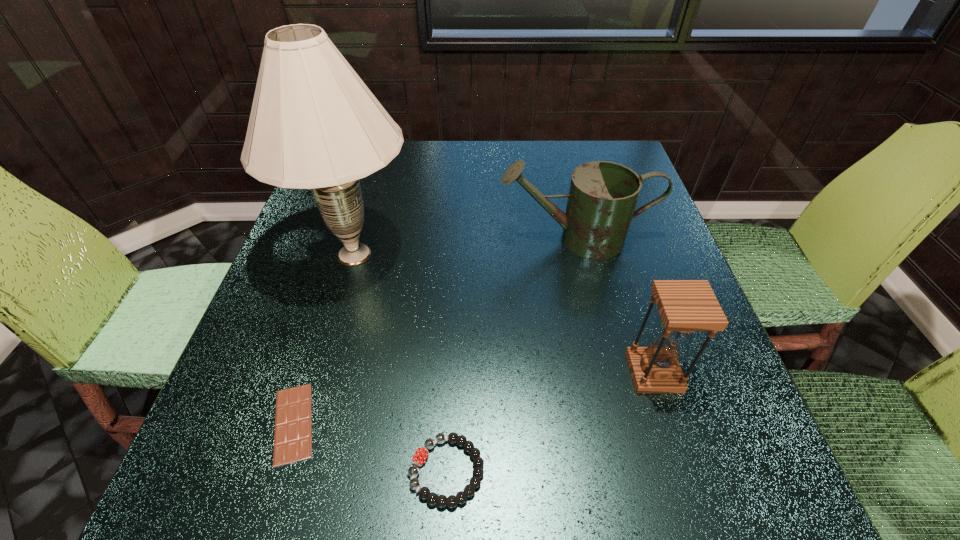
This screenshot has width=960, height=540. I want to click on lampshade, so [x=314, y=124].

At what (x,y) coordinates should I click in order to perform the action: click on watering can. Please return your answer as a coordinate pair (x, y). This screenshot has height=540, width=960. Looking at the image, I should click on (602, 198).

Identify the location of hourglass. (685, 306).

Locate an element on the screen. The width and height of the screenshot is (960, 540). the fourth tallest object is located at coordinates coord(421,454).

At what (x,y) coordinates should I click in order to perform the action: click on bracelet. Please return your answer as a coordinate pair (x, y). Looking at the image, I should click on (421, 454).

Image resolution: width=960 pixels, height=540 pixels. In order to click on chocolate bar in this screenshot , I will do click(293, 421).

The height and width of the screenshot is (540, 960). I want to click on vacant space situated on the front of the lampshade, so click(x=320, y=375).

Find the location of a particular element. The height and width of the screenshot is (540, 960). free location located with the spout on the watering can is located at coordinates (452, 239).

The height and width of the screenshot is (540, 960). What are the coordinates of `free region located with the spout on the watering can` in the screenshot? It's located at (375, 239).

Locate an element on the screen. This screenshot has height=540, width=960. vacant space located with the spout on the watering can is located at coordinates (396, 239).